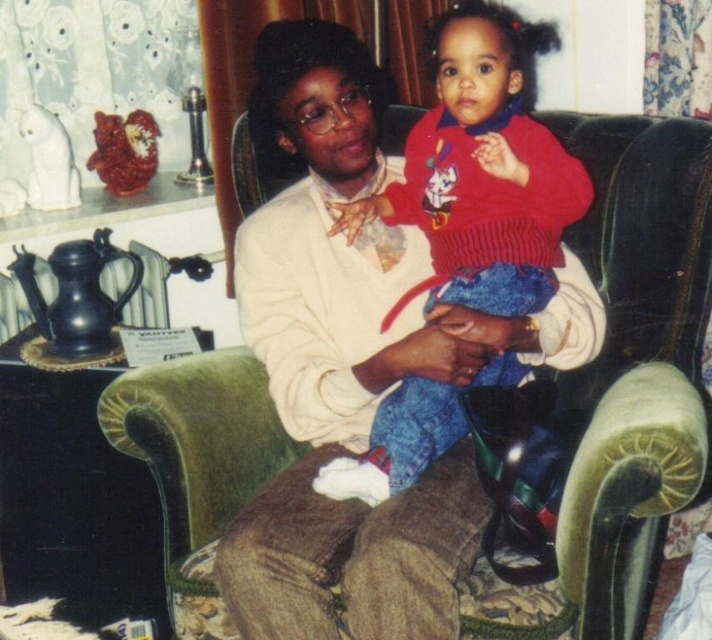
Question: Can you confirm if velvet green couch at center is positioned to the left of red knit sweater at center?

Choices:
 (A) yes
 (B) no

Answer: (B)

Question: Which object appears closest to the camera in this image?

Choices:
 (A) red knit sweater at center
 (B) velvet green couch at center

Answer: (B)

Question: Which of the following is the farthest from the observer?

Choices:
 (A) red knit sweater at center
 (B) velvet green couch at center

Answer: (A)

Question: Is velvet green couch at center above red knit sweater at center?

Choices:
 (A) no
 (B) yes

Answer: (A)

Question: Is velvet green couch at center below red knit sweater at center?

Choices:
 (A) yes
 (B) no

Answer: (A)